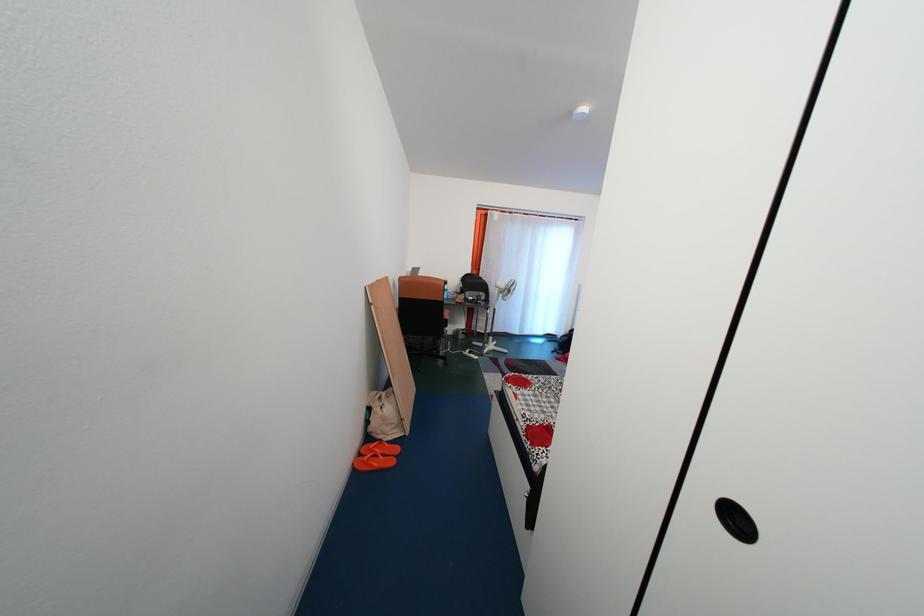
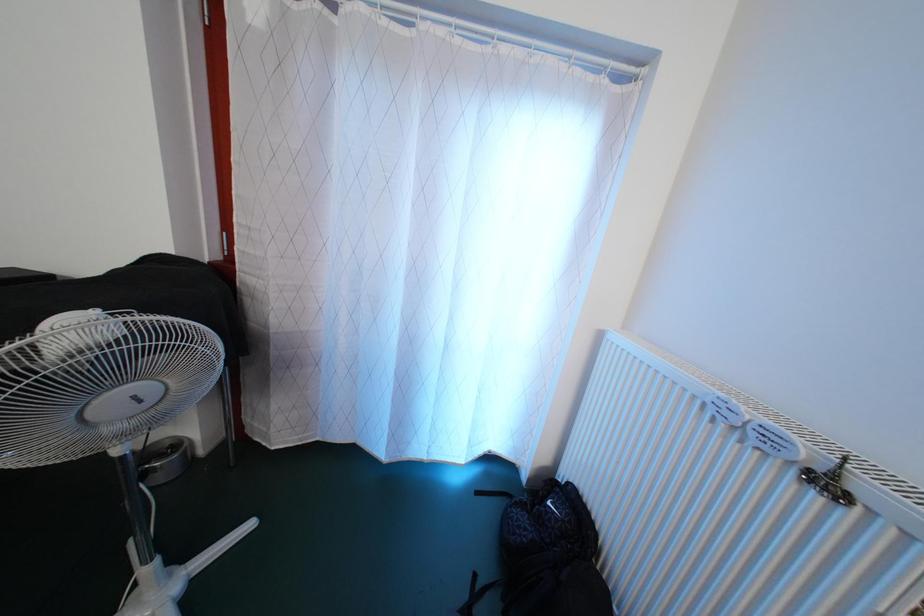
Which direction would the cameraman need to move to produce the second image?

The movement direction of the cameraman is right, forward.